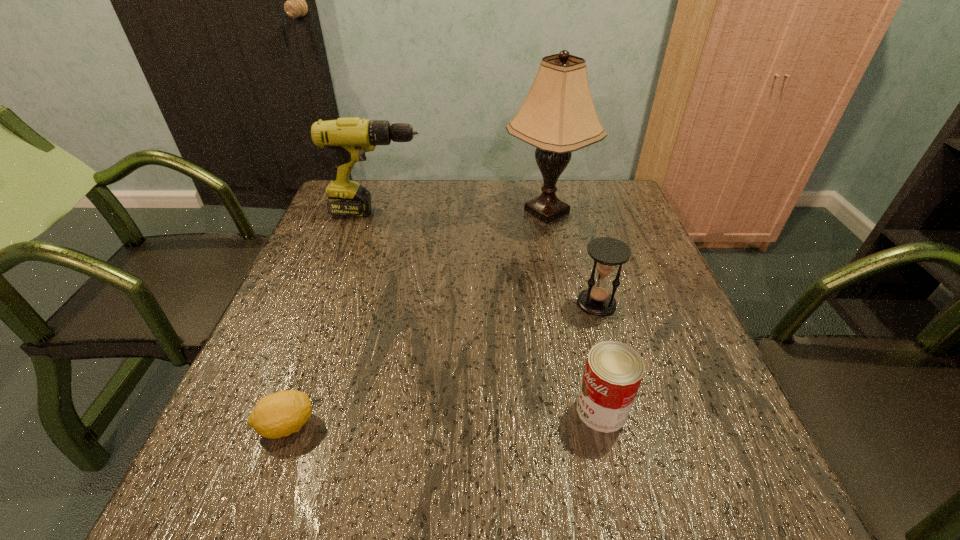
Find the location of a particular element. Image resolution: width=960 pixels, height=540 pixels. lamp is located at coordinates (558, 116).

The image size is (960, 540). I want to click on the second tallest object, so click(x=349, y=138).

Where is `the third farthest object`? This screenshot has width=960, height=540. the third farthest object is located at coordinates (607, 253).

You are a GUI agent. You are given a task and a screenshot of the screen. Output one action in this format:
    pyautogui.click(x=<x>, y=<y>)
    Task: Click on the can
    
    Given the screenshot: What is the action you would take?
    pyautogui.click(x=613, y=372)

Find the location of `the shortest object`. the shortest object is located at coordinates (280, 414).

Locate an element on the screen. Image resolution: width=960 pixels, height=540 pixels. free region located 0.360m on the front of the lamp is located at coordinates coord(573,339).

Locate an element on the screen. The image size is (960, 540). free space located on the handle side of the second tallest object is located at coordinates (474, 212).

This screenshot has height=540, width=960. Find the location of `free spot located 0.360m on the back of the third farthest object`. free spot located 0.360m on the back of the third farthest object is located at coordinates (569, 207).

Identify the location of vacant space located on the front label of the can. (538, 410).

Locate an element on the screen. The height and width of the screenshot is (540, 960). free space located on the front label of the can is located at coordinates (470, 410).